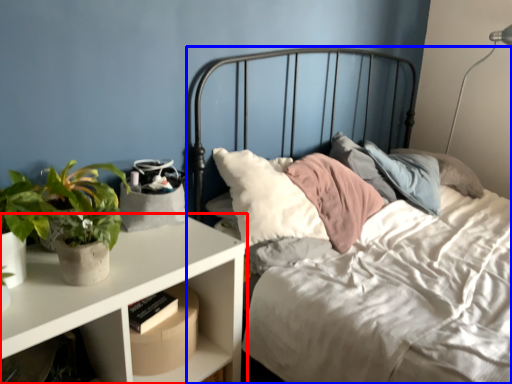
Question: Which object is further to the camera taking this photo, nightstand (highlighted by a red box) or bed (highlighted by a blue box)?

Choices:
 (A) nightstand
 (B) bed

Answer: (A)